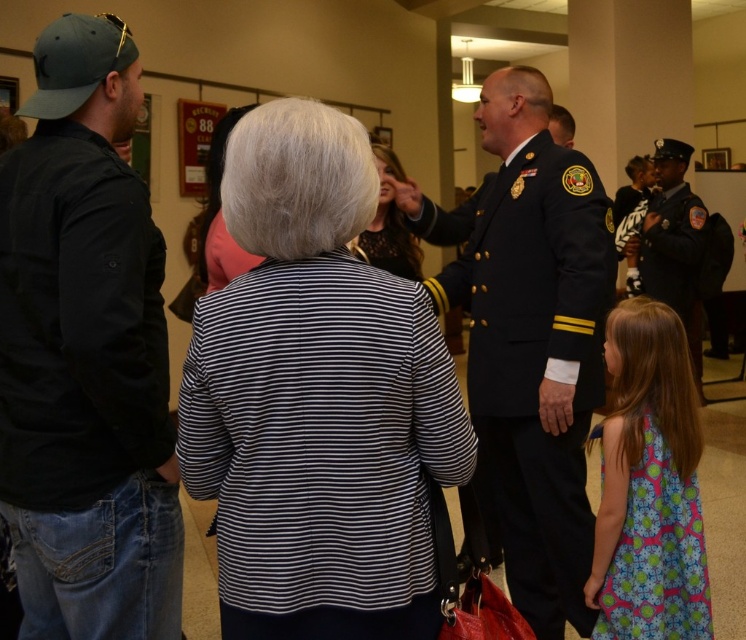
What is the exact 2D coordinate of the striped fabric jacket at center in the image?

The striped fabric jacket at center is located at the 2D coordinate point of (316, 397).

You are standing in the hallway and want to hand a document to both the person in the striped fabric jacket at center and the person in the black lace dress at center. Which one can you reach first without moving your position?

The striped fabric jacket at center is closer to the viewer than the black lace dress at center, so you can reach the person in the striped fabric jacket at center first without moving.